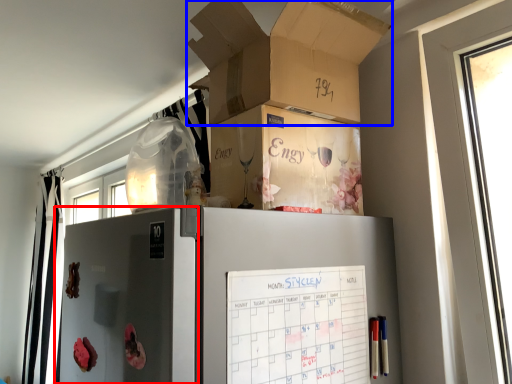
Question: Which object is further to the camera taking this photo, screen door (highlighted by a red box) or box (highlighted by a blue box)?

Choices:
 (A) screen door
 (B) box

Answer: (B)